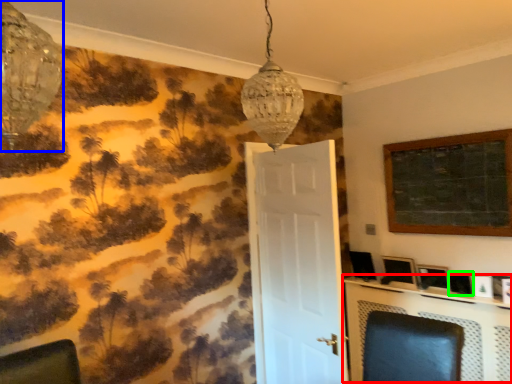
Question: Which object is the closest to the table (highlighted by a red box)? Choose among these: lamp (highlighted by a blue box) or picture frame (highlighted by a green box).

Choices:
 (A) lamp
 (B) picture frame

Answer: (B)